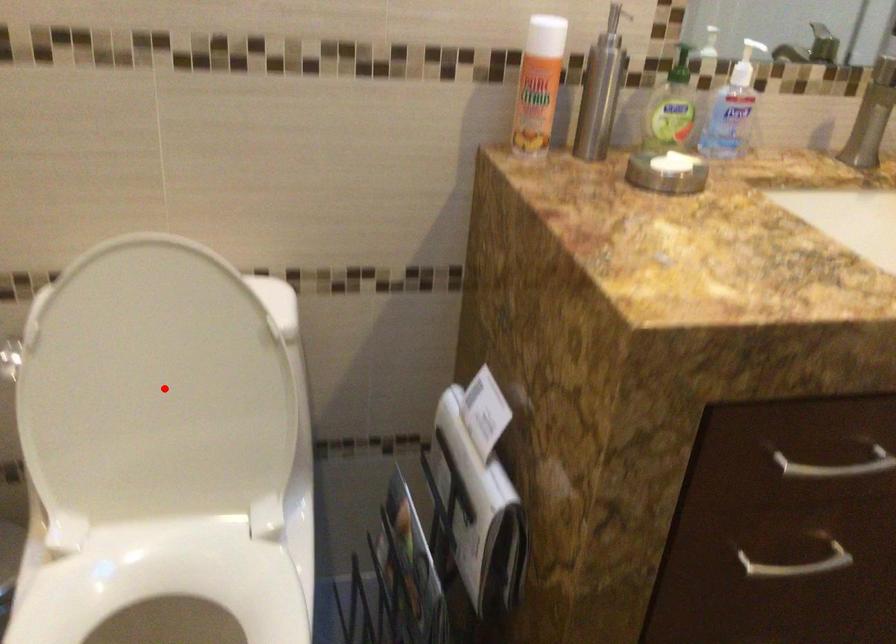
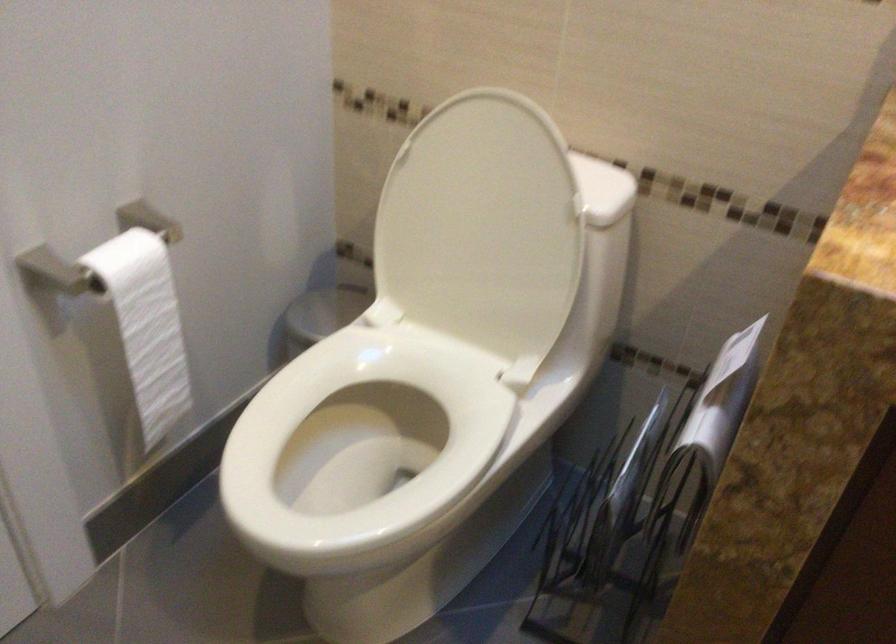
Question: I am providing you with two images of the same scene from different viewpoints. A red point is marked on the first image. At the location where the point appears in image 1, is it still visible in image 2?

Choices:
 (A) Yes
 (B) No

Answer: (A)